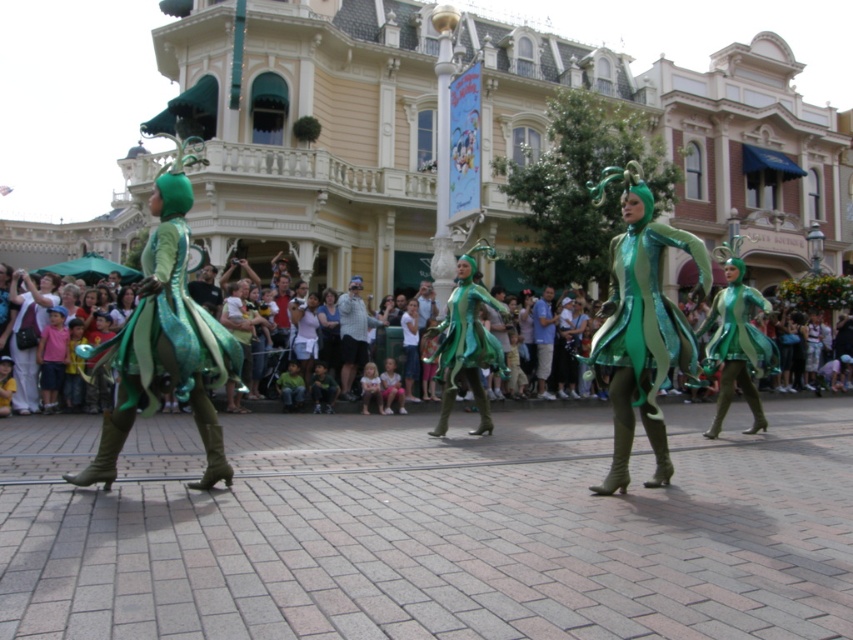
Question: Which point appears farthest from the camera in this image?

Choices:
 (A) (96, 256)
 (B) (341, 388)

Answer: (A)

Question: Which object is farther from the camera taking this photo?

Choices:
 (A) green satin dress at left
 (B) green metallic dress at center

Answer: (B)

Question: Can you confirm if blue cotton shirt at center is bigger than matte green costumes at center?

Choices:
 (A) yes
 (B) no

Answer: (B)

Question: Is green satin dress at left bigger than matte green costumes at center?

Choices:
 (A) no
 (B) yes

Answer: (A)

Question: Which point is closer to the camera?

Choices:
 (A) light gray fabric shirt at center
 (B) green metallic dress at center
 (C) matte green costumes at center

Answer: (B)

Question: Does green matte dress at center appear on the right side of matte white blouse at center?

Choices:
 (A) no
 (B) yes

Answer: (B)